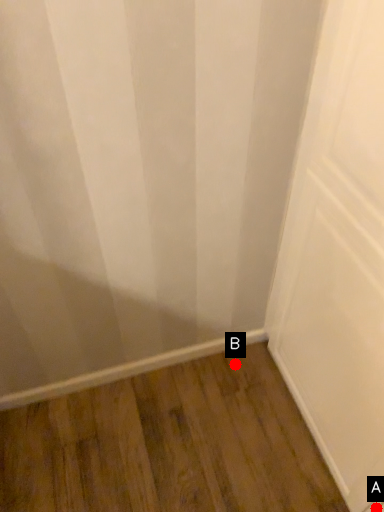
Question: Two points are circled on the image, labeled by A and B beside each circle. Which point is closer to the camera?

Choices:
 (A) A is closer
 (B) B is closer

Answer: (A)